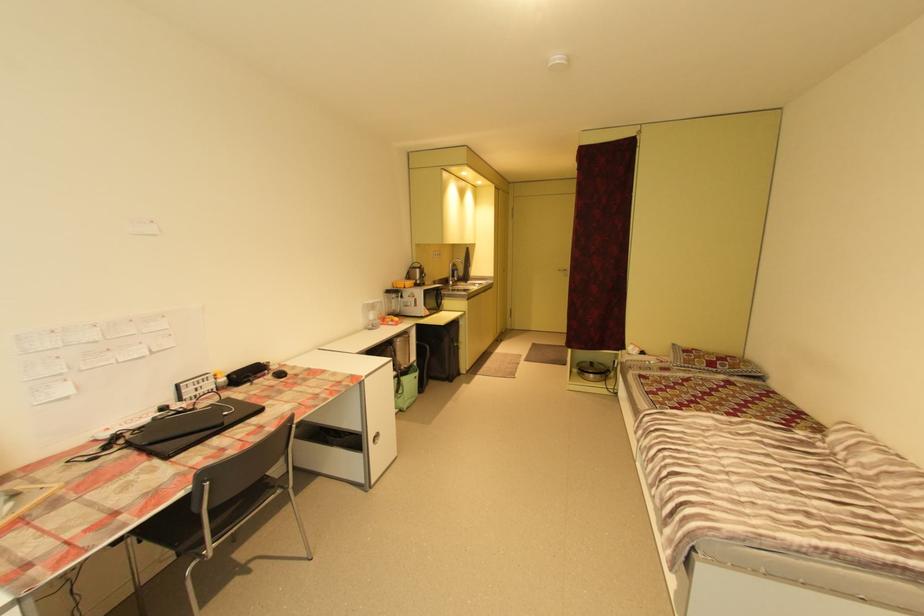
Identify the location of silver faucet handle. The image size is (924, 616). (455, 278).